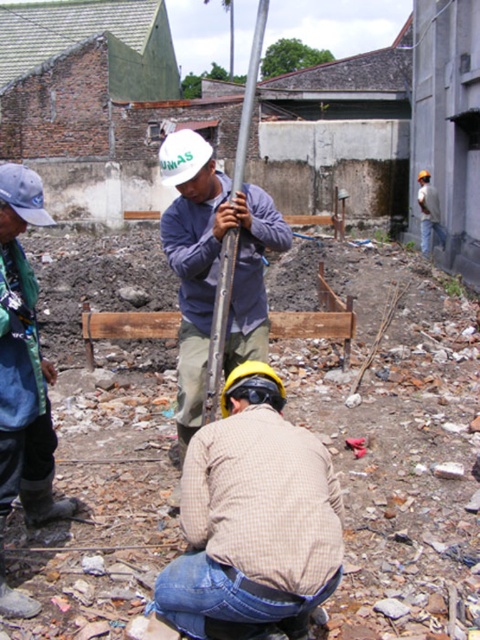
You are a safety inspector at this construction site. You notice two workers in your line of sight. One is wearing a checkered fabric shirt at center, and the other is a light gray concrete worker at upper right. Which worker should you approach first to ensure safety compliance, the one closer to you or the one further away?

You should approach the checkered fabric shirt at center first since they are closer to the viewer than the light gray concrete worker at upper right, allowing for quicker intervention if needed.

You are a safety inspector at the construction site. You need to locate the matte white helmet at center. According to the coordinates provided, where exactly is it positioned?

The matte white helmet at center is located at point coordinates 0.416 on the x axis and 0.446 on the y axis.

You are a safety inspector at the construction site. You need to ensure that all safety gear is properly worn. Which safety gear item, the matte white helmet at center or the blue rubber boots at lower left, is positioned higher in the image?

The matte white helmet at center is taller than the blue rubber boots at lower left, so the matte white helmet at center is positioned higher in the image.